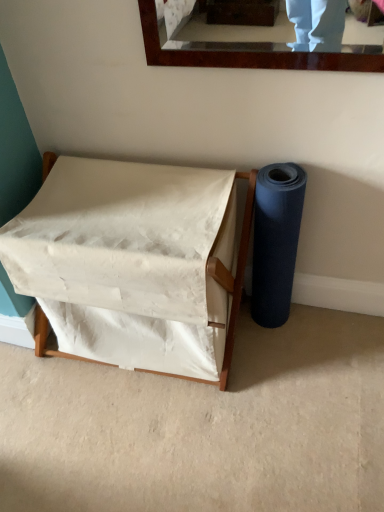
Question: From the image's perspective, is white fabric hamper at center above or below blue rubber mat at right?

Choices:
 (A) below
 (B) above

Answer: (A)

Question: Do you think white fabric hamper at center is within blue rubber mat at right, or outside of it?

Choices:
 (A) inside
 (B) outside

Answer: (B)

Question: Is white fabric hamper at center taller or shorter than blue rubber mat at right?

Choices:
 (A) short
 (B) tall

Answer: (A)

Question: Considering the positions of blue rubber mat at right and white fabric hamper at center in the image, is blue rubber mat at right wider or thinner than white fabric hamper at center?

Choices:
 (A) wide
 (B) thin

Answer: (B)

Question: Is blue rubber mat at right to the left or to the right of white fabric hamper at center in the image?

Choices:
 (A) right
 (B) left

Answer: (A)

Question: Considering their positions, is blue rubber mat at right located in front of or behind white fabric hamper at center?

Choices:
 (A) behind
 (B) front

Answer: (A)

Question: From the image's perspective, is blue rubber mat at right above or below white fabric hamper at center?

Choices:
 (A) above
 (B) below

Answer: (A)